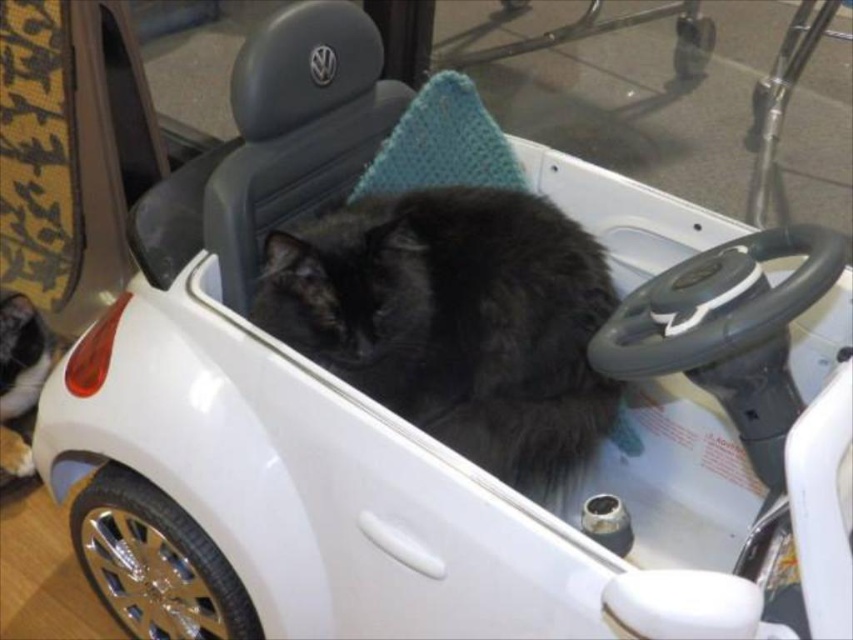
Question: Among these points, which one is farthest from the camera?

Choices:
 (A) (451, 292)
 (B) (4, 396)

Answer: (B)

Question: Is black fluffy cat at center smaller than black fur cat at lower left?

Choices:
 (A) no
 (B) yes

Answer: (A)

Question: Is black fluffy cat at center positioned at the back of black fur cat at lower left?

Choices:
 (A) yes
 (B) no

Answer: (B)

Question: Is black fluffy cat at center closer to camera compared to black fur cat at lower left?

Choices:
 (A) no
 (B) yes

Answer: (B)

Question: Which point is farther from the camera taking this photo?

Choices:
 (A) (305, 253)
 (B) (4, 419)

Answer: (B)